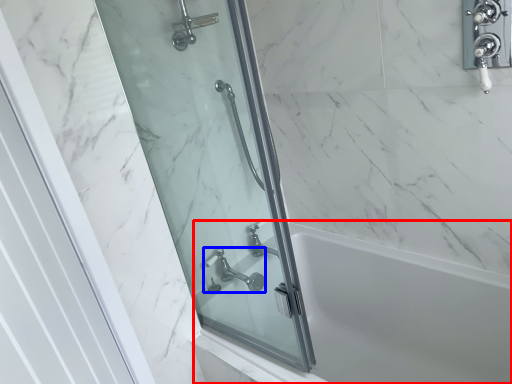
Question: Which object is further to the camera taking this photo, bath (highlighted by a red box) or tap (highlighted by a blue box)?

Choices:
 (A) bath
 (B) tap

Answer: (B)